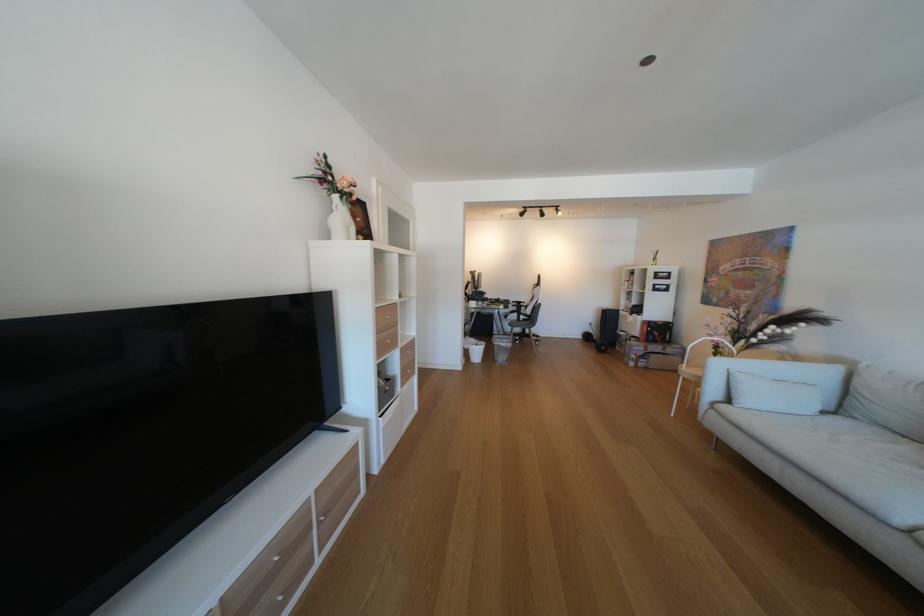
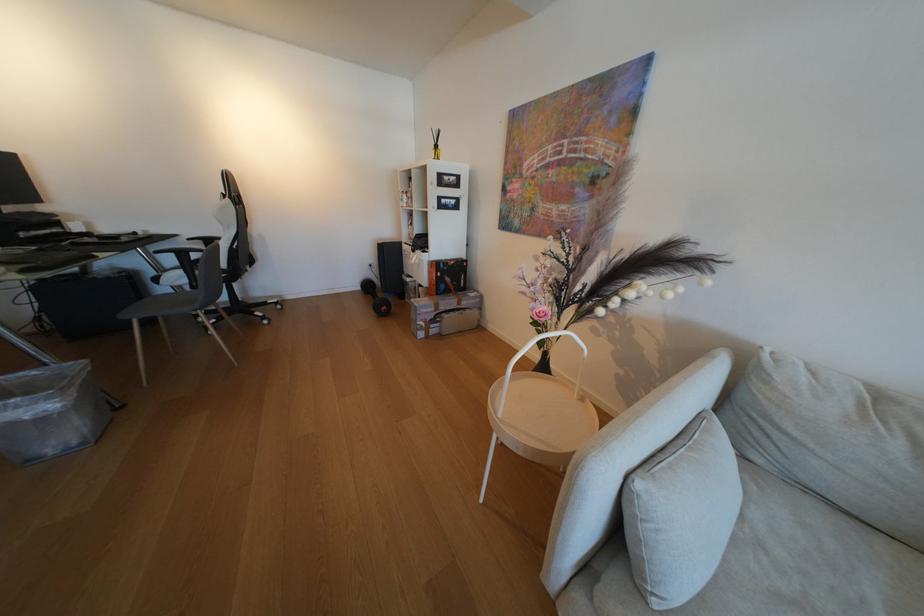
Find the pixel in the second image that matches point (653, 358) in the first image.

(444, 322)